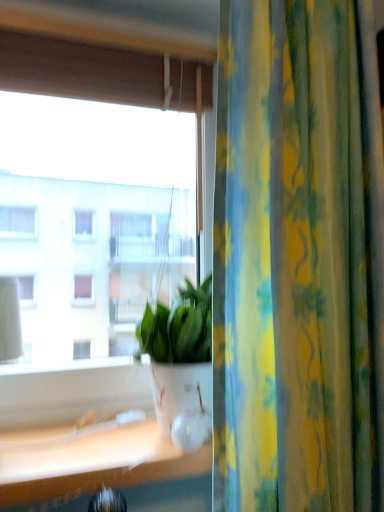
Question: Is yellow-green floral fabric curtain at right next to white glossy pot at center?

Choices:
 (A) no
 (B) yes

Answer: (A)

Question: From a real-world perspective, does yellow-green floral fabric curtain at right sit lower than white glossy pot at center?

Choices:
 (A) yes
 (B) no

Answer: (B)

Question: Considering the relative sizes of yellow-green floral fabric curtain at right and white glossy pot at center in the image provided, is yellow-green floral fabric curtain at right taller than white glossy pot at center?

Choices:
 (A) yes
 (B) no

Answer: (A)

Question: Is yellow-green floral fabric curtain at right positioned beyond the bounds of white glossy pot at center?

Choices:
 (A) yes
 (B) no

Answer: (A)

Question: From the image's perspective, does yellow-green floral fabric curtain at right appear lower than white glossy pot at center?

Choices:
 (A) no
 (B) yes

Answer: (A)

Question: Looking at the image, does white glossy pot at center seem bigger or smaller compared to transparent glass window at center?

Choices:
 (A) small
 (B) big

Answer: (A)

Question: Considering their positions, is white glossy pot at center located in front of or behind transparent glass window at center?

Choices:
 (A) behind
 (B) front

Answer: (B)

Question: In the image, is white glossy pot at center on the left side or the right side of transparent glass window at center?

Choices:
 (A) right
 (B) left

Answer: (A)

Question: In terms of height, does white glossy pot at center look taller or shorter compared to transparent glass window at center?

Choices:
 (A) tall
 (B) short

Answer: (B)

Question: Is yellow-green floral fabric curtain at right taller or shorter than white glossy pot at center?

Choices:
 (A) tall
 (B) short

Answer: (A)

Question: Is yellow-green floral fabric curtain at right situated inside white glossy pot at center or outside?

Choices:
 (A) inside
 (B) outside

Answer: (B)

Question: Does point (x=321, y=477) appear closer or farther from the camera than point (x=152, y=382)?

Choices:
 (A) farther
 (B) closer

Answer: (B)

Question: Visually, is yellow-green floral fabric curtain at right positioned to the left or to the right of white glossy pot at center?

Choices:
 (A) right
 (B) left

Answer: (A)

Question: Is point (173, 88) positioned closer to the camera than point (193, 397)?

Choices:
 (A) closer
 (B) farther

Answer: (B)

Question: From a real-world perspective, is transparent glass window at center above or below white glossy pot at center?

Choices:
 (A) above
 (B) below

Answer: (A)